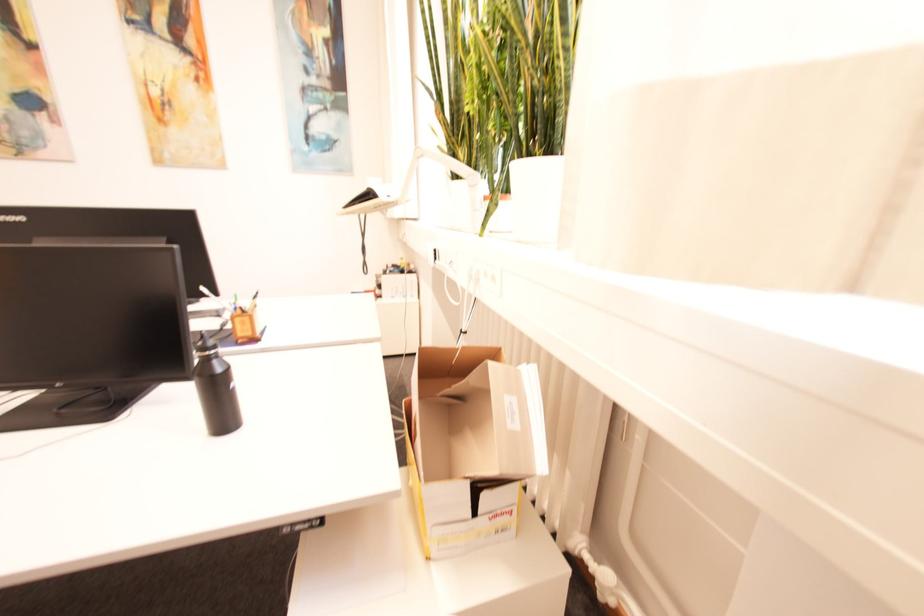
You are a GUI agent. You are given a task and a screenshot of the screen. Output one action in this format:
    pyautogui.click(x=<x>, y=<y>)
    Task: Click on the desk lamp head
    This screenshot has height=616, width=924.
    Given the screenshot: What is the action you would take?
    pyautogui.click(x=369, y=203)